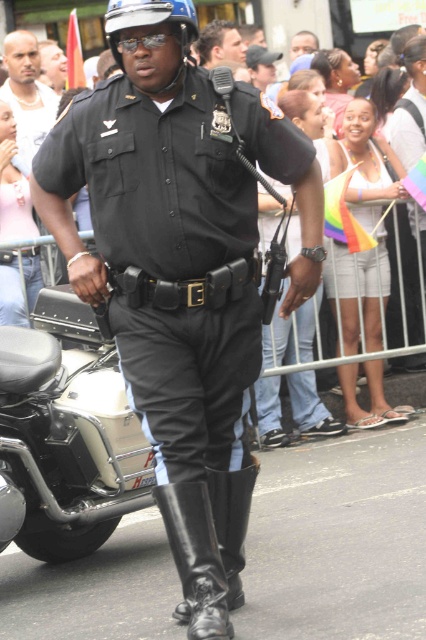
Does matte black uniform at center have a smaller size compared to black leather boot at lower center?

Incorrect, matte black uniform at center is not smaller in size than black leather boot at lower center.

Who is more distant from viewer, (190, 349) or (241, 502)?

Positioned behind is point (241, 502).

Between point (187, 90) and point (209, 481), which one is positioned behind?

The point (209, 481) is more distant.

I want to click on matte black uniform at center, so click(x=181, y=272).

Is point (210, 509) positioned behind point (239, 541)?

No, it is not.

Is black leather boot at center positioned before black leather boot at lower center?

Yes, it is in front of black leather boot at lower center.

Which is behind, point (198, 572) or point (199, 632)?

Positioned behind is point (198, 572).

Where is `black leather boot at center`? black leather boot at center is located at coordinates (195, 560).

Can you confirm if smooth skin face at upper left is wider than smooth skin at center?

Yes.

Is smooth skin face at upper left above smooth skin at center?

No.

Is point (13, 45) behind point (232, 54)?

No, it is in front of (232, 54).

You are a GUI agent. You are given a task and a screenshot of the screen. Output one action in this format:
    pyautogui.click(x=<x>, y=<y>)
    Task: Click on the smooth skin face at upper left
    The height and width of the screenshot is (640, 426).
    Given the screenshot: What is the action you would take?
    pyautogui.click(x=26, y=96)